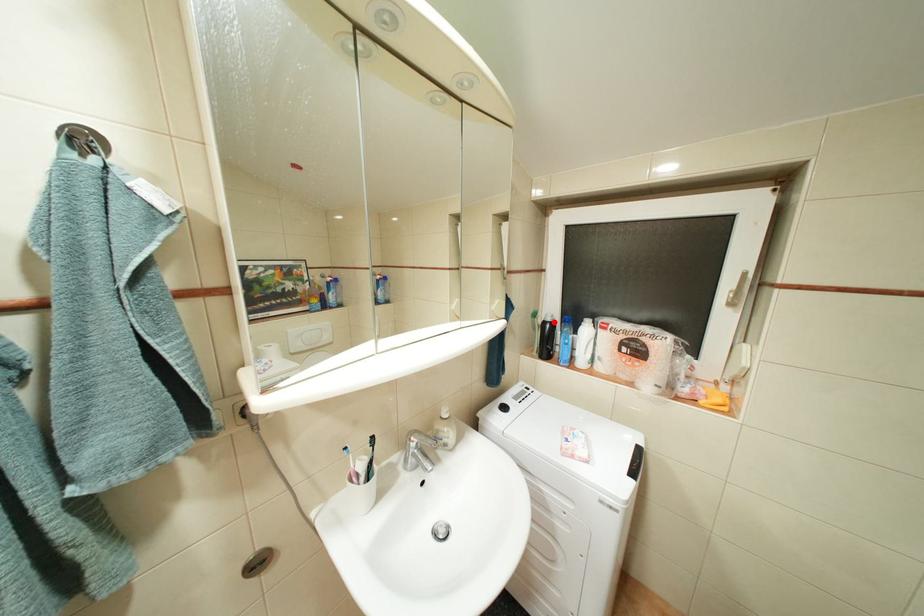
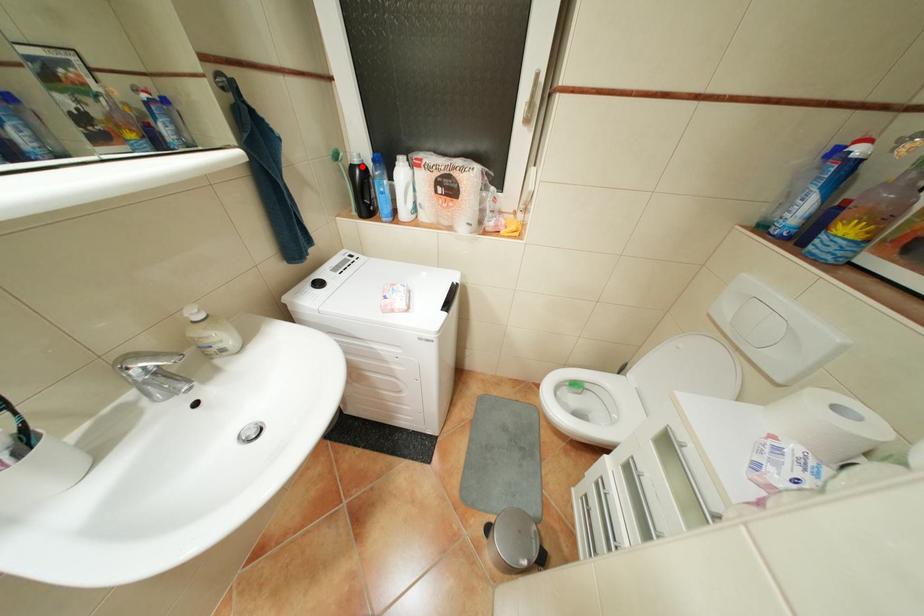
I am providing you with two images of the same scene from different viewpoints. A red point is marked on the first image and another point is marked on the second image. Do the highlighted points in image1 and image2 indicate the same real-world spot?

Yes